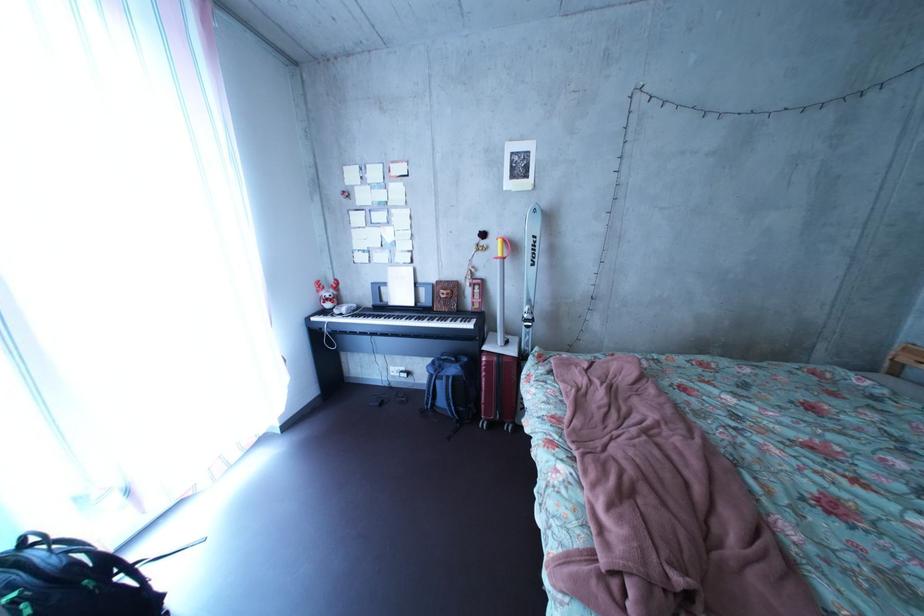
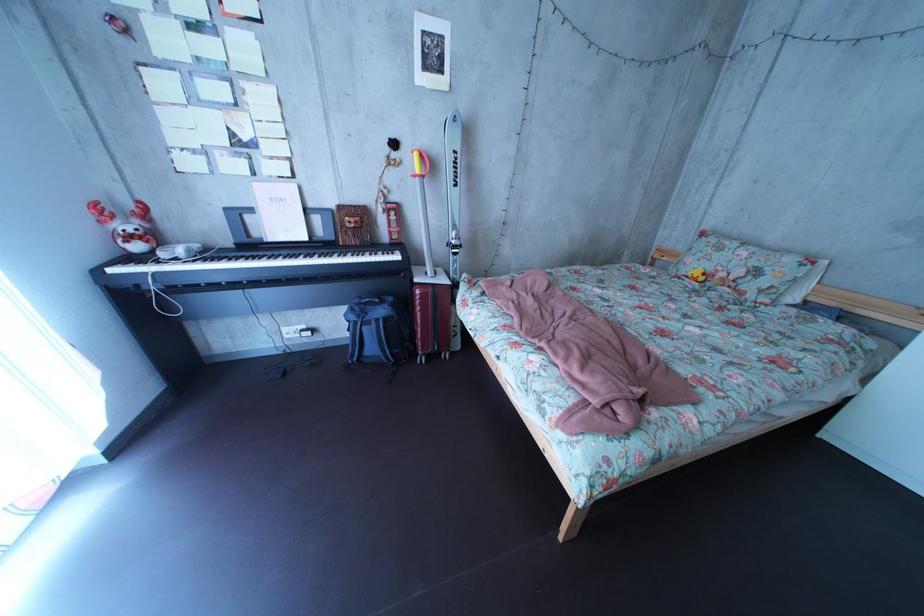
Locate, in the second image, the point that corresponds to pixel 372 320 in the first image.

(225, 262)